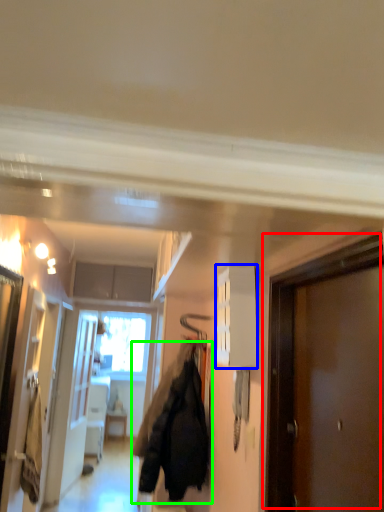
Question: Which object is the farthest from door (highlighted by a red box)? Choose among these: cabinetry (highlighted by a blue box) or jacket (highlighted by a green box).

Choices:
 (A) cabinetry
 (B) jacket

Answer: (B)